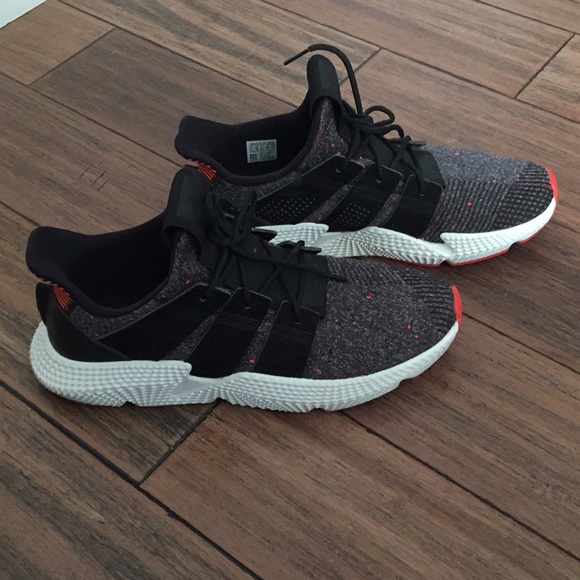
The image size is (580, 580). In order to click on floor in this screenshot , I will do `click(368, 518)`.